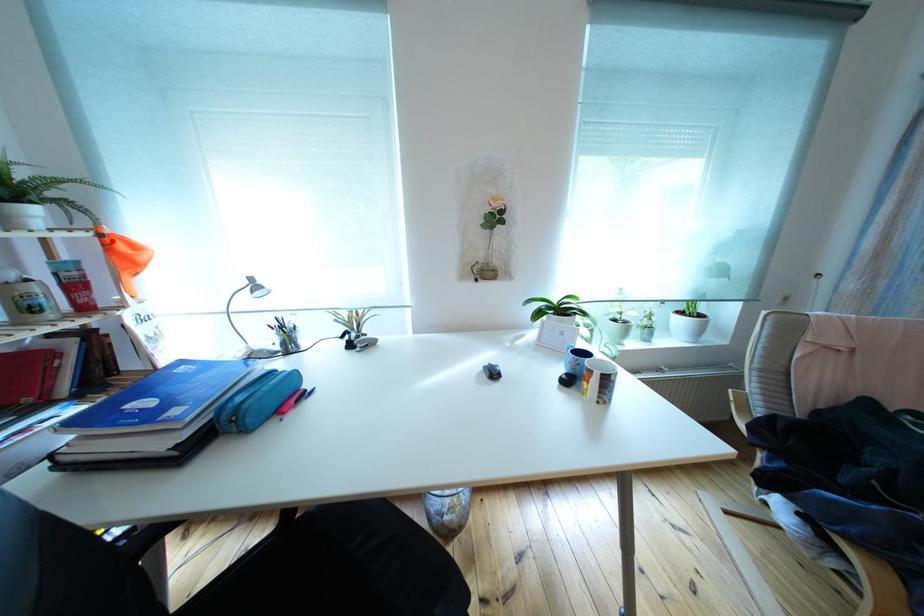
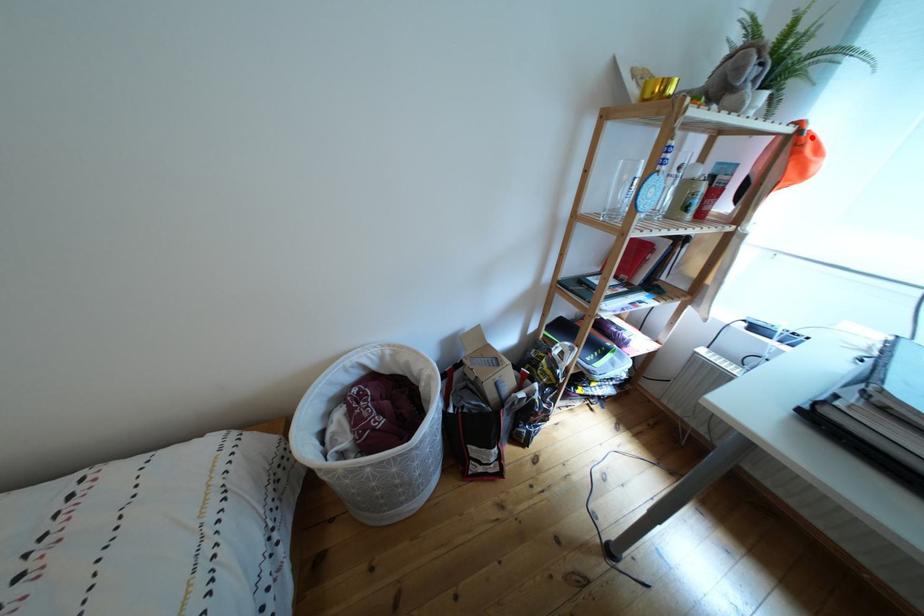
I am providing you with two images of the same scene from different viewpoints. A red point is marked on the first image and another point is marked on the second image. Is the red point in image1 aligned with the point shown in image2?

Yes